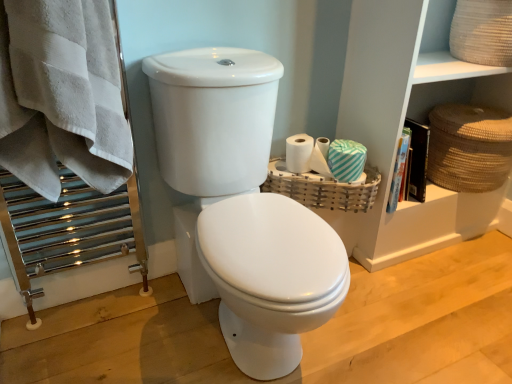
Locate an element on the screen. The image size is (512, 384). vacant area situated to the left side of white glossy toilet at center is located at coordinates (118, 333).